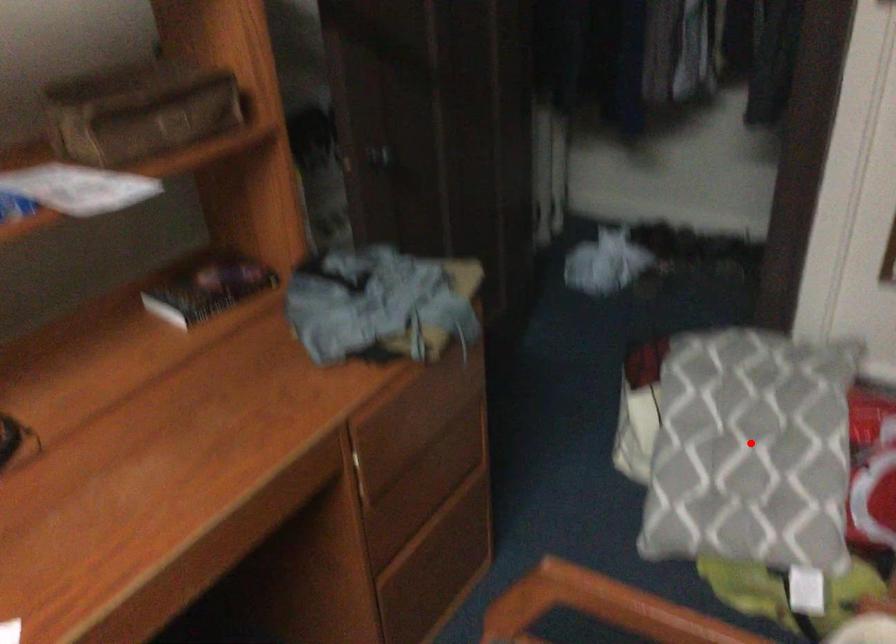
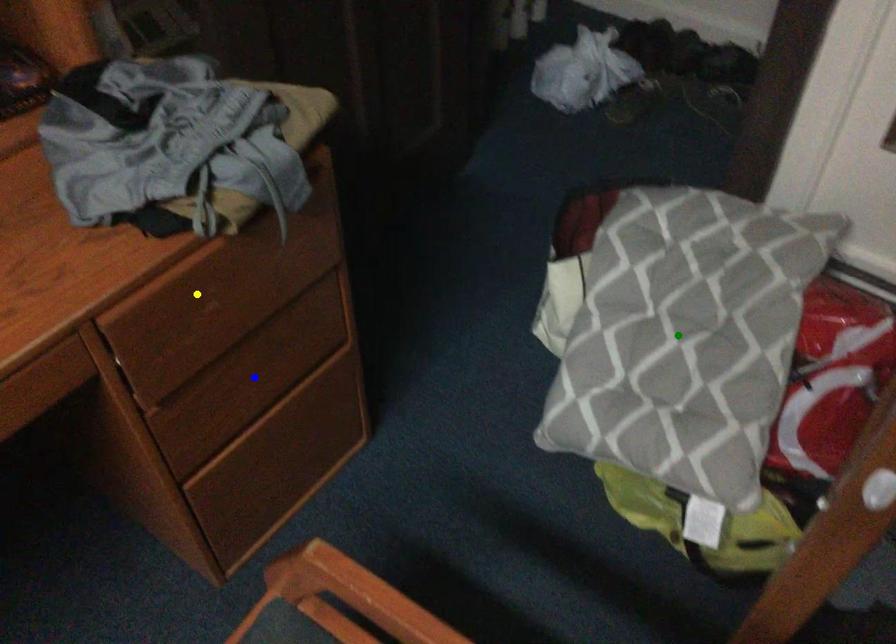
Question: I am providing you with two images of the same scene from different viewpoints. A red point is marked on the first image. You are given multiple points on the second image. Which mark in image 2 goes with the point in image 1?

Choices:
 (A) blue point
 (B) green point
 (C) yellow point

Answer: (B)